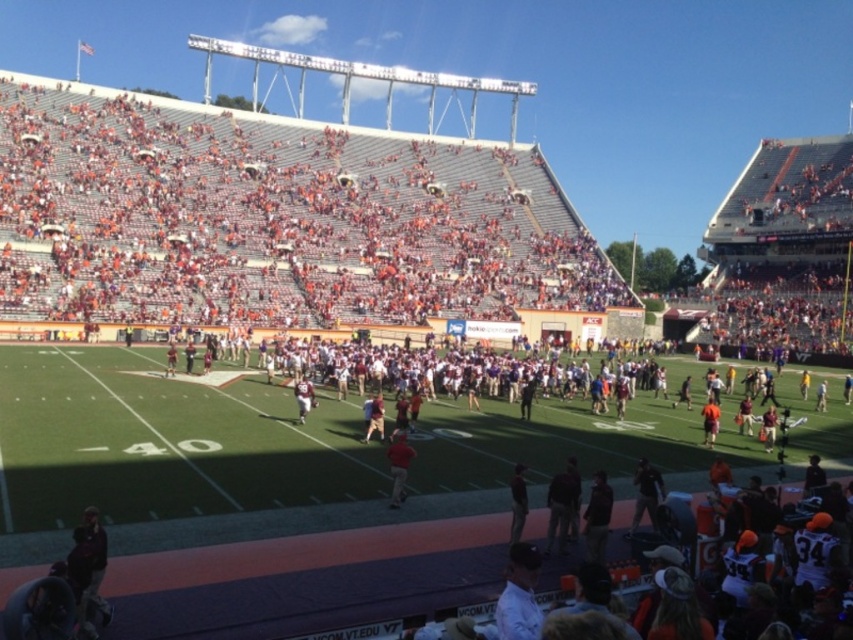
Does dark gray uniform at center have a greater height compared to red matte shirt at center?

No, dark gray uniform at center is not taller than red matte shirt at center.

Is point (642, 465) farther from viewer compared to point (396, 442)?

No.

At what (x,y) coordinates should I click in order to perform the action: click on dark gray uniform at center. Please return your answer as a coordinate pair (x, y). The image size is (853, 640). Looking at the image, I should click on 646,493.

At what (x,y) coordinates should I click in order to perform the action: click on dark gray uniform at center. Please return your answer as a coordinate pair (x, y). Image resolution: width=853 pixels, height=640 pixels. Looking at the image, I should click on (646, 493).

Measure the distance from dark gray uniform at center to dark brown leather jacket at center.

dark gray uniform at center and dark brown leather jacket at center are 23.98 feet apart.

Between point (643, 490) and point (517, 528), which one is positioned in front?

Point (517, 528)

Locate an element on the screen. The height and width of the screenshot is (640, 853). dark gray uniform at center is located at coordinates (646, 493).

Where is `dark gray uniform at center`? Image resolution: width=853 pixels, height=640 pixels. dark gray uniform at center is located at coordinates (646, 493).

Does point (654, 490) lie in front of point (299, 413)?

That is True.

Locate an element on the screen. The image size is (853, 640). dark gray uniform at center is located at coordinates (646, 493).

The width and height of the screenshot is (853, 640). Find the location of `dark gray uniform at center`. dark gray uniform at center is located at coordinates coord(646,493).